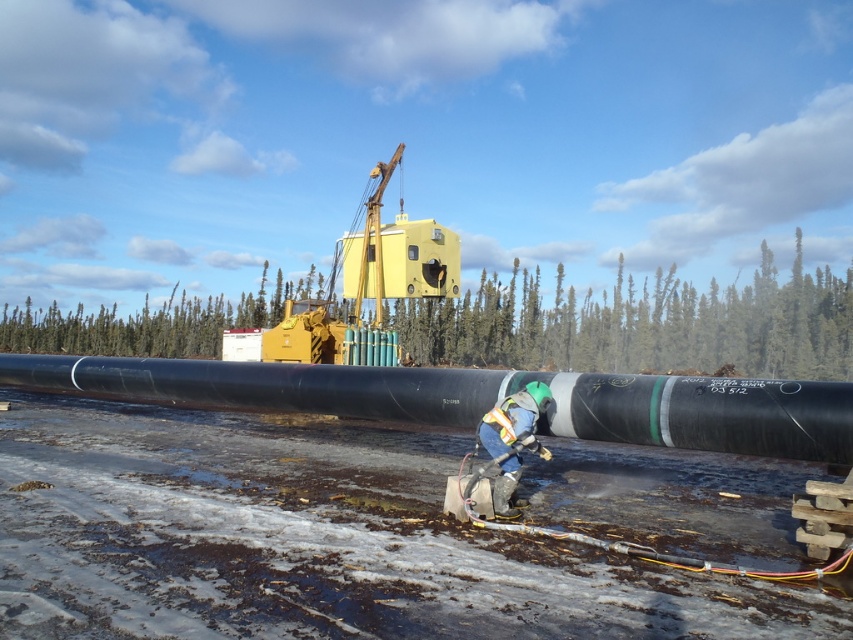
Does black rubber pipe at center have a larger size compared to reflective silver helmet at center?

Correct, black rubber pipe at center is larger in size than reflective silver helmet at center.

From the picture: Who is shorter, black rubber pipe at center or reflective silver helmet at center?

reflective silver helmet at center is shorter.

What are the coordinates of `black rubber pipe at center` in the screenshot? It's located at (x=480, y=400).

Locate an element on the screen. Image resolution: width=853 pixels, height=640 pixels. black rubber pipe at center is located at coordinates (480, 400).